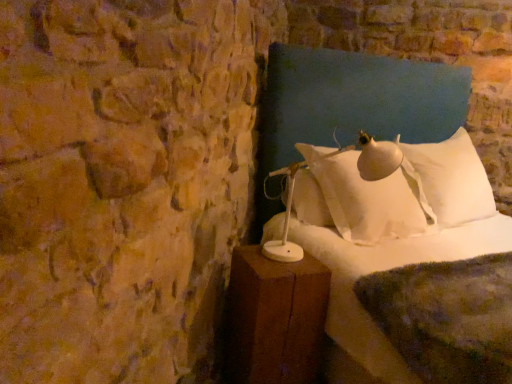
What is the approximate width of white soft pillow at upper right?

The width of white soft pillow at upper right is 45.50 centimeters.

This screenshot has width=512, height=384. What do you see at coordinates (395, 216) in the screenshot? I see `white soft bed at center` at bounding box center [395, 216].

The image size is (512, 384). I want to click on brown wooden nightstand at lower right, so click(x=274, y=319).

Considering the positions of point (248, 331) and point (334, 161), is point (248, 331) closer or farther from the camera than point (334, 161)?

Point (248, 331).

Is white soft bed at center at the back of brown wooden nightstand at lower right?

No.

Considering the sizes of brown wooden nightstand at lower right and white soft bed at center in the image, is brown wooden nightstand at lower right wider or thinner than white soft bed at center?

Considering their sizes, brown wooden nightstand at lower right looks slimmer than white soft bed at center.

Who is bigger, brown wooden nightstand at lower right or white soft bed at center?

white soft bed at center is bigger.

How different are the orientations of brown wooden nightstand at lower right and white soft pillow at upper right in degrees?

There is a 4.91-degree angle between the facing directions of brown wooden nightstand at lower right and white soft pillow at upper right.

Is white soft pillow at upper right at the back of brown wooden nightstand at lower right?

No.

Between brown wooden nightstand at lower right and white soft pillow at upper right, which one appears on the right side from the viewer's perspective?

white soft pillow at upper right.

Relative to white soft pillow at upper right, is brown wooden nightstand at lower right in front or behind?

Clearly, brown wooden nightstand at lower right is in front of white soft pillow at upper right.

Who is bigger, white soft pillow at upper right or white soft bed at center?

Bigger between the two is white soft bed at center.

Is white soft pillow at upper right inside the boundaries of white soft bed at center, or outside?

white soft pillow at upper right fits inside white soft bed at center.

Looking at this image, between white soft pillow at upper right and white soft bed at center, which one has more height?

white soft bed at center is taller.

Which is in front, point (417, 204) or point (297, 232)?

The point (297, 232) is more forward.

Between point (505, 355) and point (305, 187), which one is positioned behind?

The point (305, 187) is farther.

Consider the image. Is white soft bed at center oriented away from white soft pillow at upper right?

Absolutely, white soft bed at center is directed away from white soft pillow at upper right.

Is white soft bed at center bigger or smaller than white soft pillow at upper right?

white soft bed at center is bigger than white soft pillow at upper right.

From a real-world perspective, between white soft bed at center and brown wooden nightstand at lower right, who is vertically higher?

white soft bed at center, from a real-world perspective.

Does white soft bed at center turn towards brown wooden nightstand at lower right?

No.

Are white soft bed at center and brown wooden nightstand at lower right making contact?

They are not placed beside each other.

Between white soft bed at center and brown wooden nightstand at lower right, which one appears on the left side from the viewer's perspective?

Positioned to the left is brown wooden nightstand at lower right.

Considering the sizes of objects white soft pillow at upper right and brown wooden nightstand at lower right in the image provided, who is smaller, white soft pillow at upper right or brown wooden nightstand at lower right?

Smaller between the two is brown wooden nightstand at lower right.

From a real-world perspective, is white soft pillow at upper right positioned over brown wooden nightstand at lower right based on gravity?

Correct, in the physical world, white soft pillow at upper right is higher than brown wooden nightstand at lower right.

From the image's perspective, would you say white soft pillow at upper right is shown under brown wooden nightstand at lower right?

No, from the image's perspective, white soft pillow at upper right is not below brown wooden nightstand at lower right.

Locate an element on the screen. furniture below the white soft bed at center (from the image's perspective) is located at coordinates [x=274, y=319].

In the image, there is a brown wooden nightstand at lower right. At what (x,y) coordinates should I click in order to perform the action: click on pillow above it (from the image's perspective). Please return your answer as a coordinate pair (x, y). Looking at the image, I should click on (360, 198).

Estimate the real-world distances between objects in this image. Which object is further from brown wooden nightstand at lower right, white soft pillow at upper right or white soft bed at center?

Based on the image, white soft pillow at upper right appears to be further to brown wooden nightstand at lower right.

Based on their spatial positions, is brown wooden nightstand at lower right or white soft pillow at upper right further from white soft bed at center?

brown wooden nightstand at lower right is further to white soft bed at center.

Considering their positions, is brown wooden nightstand at lower right positioned further to white soft pillow at upper right than white soft bed at center?

The object further to white soft pillow at upper right is brown wooden nightstand at lower right.

Based on their spatial positions, is white soft bed at center or white soft pillow at upper right further from brown wooden nightstand at lower right?

Based on the image, white soft pillow at upper right appears to be further to brown wooden nightstand at lower right.

Considering their positions, is white soft bed at center positioned closer to white soft pillow at upper right than brown wooden nightstand at lower right?

Among the two, white soft bed at center is located nearer to white soft pillow at upper right.

Considering their positions, is white soft pillow at upper right positioned closer to white soft bed at center than brown wooden nightstand at lower right?

white soft pillow at upper right lies closer to white soft bed at center than the other object.

Locate an element on the screen. The image size is (512, 384). furniture between white soft bed at center and white soft pillow at upper right from front to back is located at coordinates (274, 319).